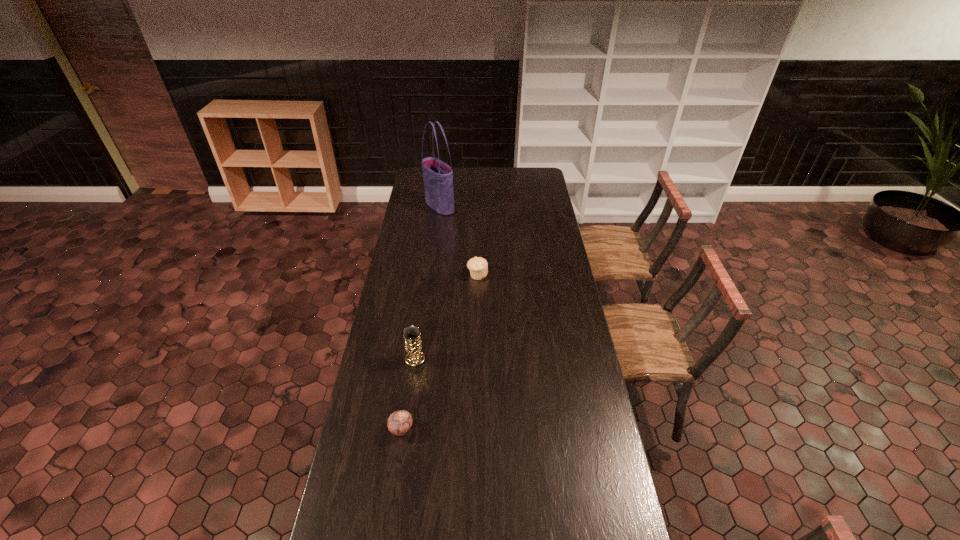
You are a GUI agent. You are given a task and a screenshot of the screen. Output one action in this format:
    pyautogui.click(x=<x>, y=<y>)
    Task: Click on the vacant area situated 0.330m on the right of the third nearest object
    The width and height of the screenshot is (960, 540).
    Given the screenshot: What is the action you would take?
    pyautogui.click(x=558, y=275)

You are a GUI agent. You are given a task and a screenshot of the screen. Output one action in this format:
    pyautogui.click(x=<x>, y=<y>)
    Task: Click on the vacant space located on the right of the left muffin
    
    Given the screenshot: What is the action you would take?
    pyautogui.click(x=530, y=429)

This screenshot has width=960, height=540. I want to click on tote bag present at the left edge, so click(x=438, y=176).

Where is `chalice positioned at the left edge`? Image resolution: width=960 pixels, height=540 pixels. chalice positioned at the left edge is located at coordinates (413, 345).

Locate an element on the screen. Image resolution: width=960 pixels, height=540 pixels. muffin positioned at the left edge is located at coordinates (399, 422).

This screenshot has height=540, width=960. In the image, there is a desktop. Identify the location of vacant space at the left edge. (401, 350).

Image resolution: width=960 pixels, height=540 pixels. I want to click on free space at the right edge of the desktop, so click(523, 195).

Where is `free space at the far right corner of the desktop`? free space at the far right corner of the desktop is located at coordinates (544, 179).

Locate an element on the screen. The image size is (960, 540). free spot between the tallest object and the taller muffin is located at coordinates (459, 241).

Locate an element on the screen. Image resolution: width=960 pixels, height=540 pixels. vacant area that lies between the tote bag and the chalice is located at coordinates (427, 282).